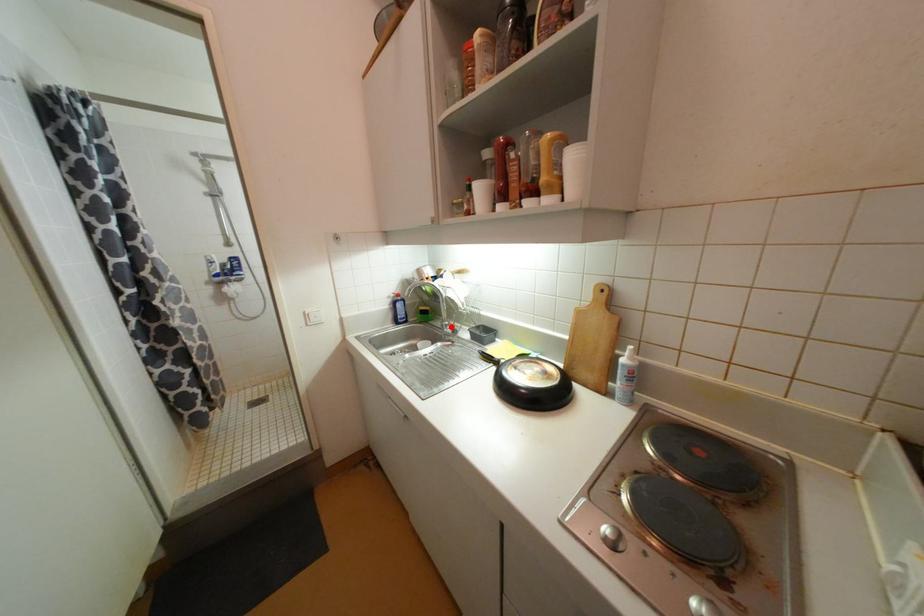
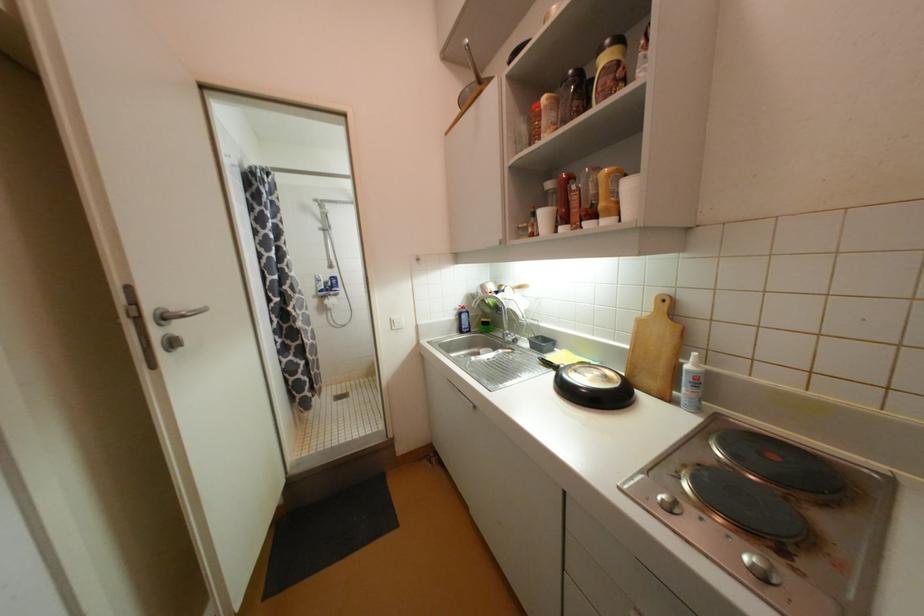
Locate, in the second image, the point that corresponds to the highlighted location in the first image.

(513, 336)